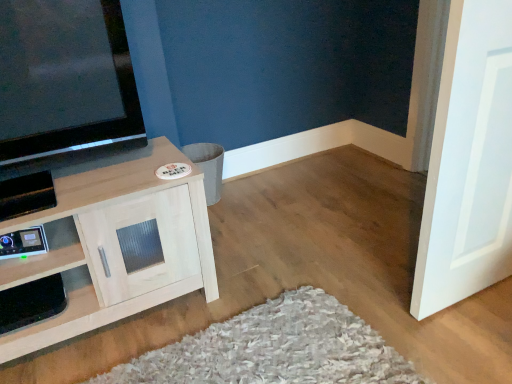
The height and width of the screenshot is (384, 512). Identify the location of vacant space in front of white matte door at right. (476, 335).